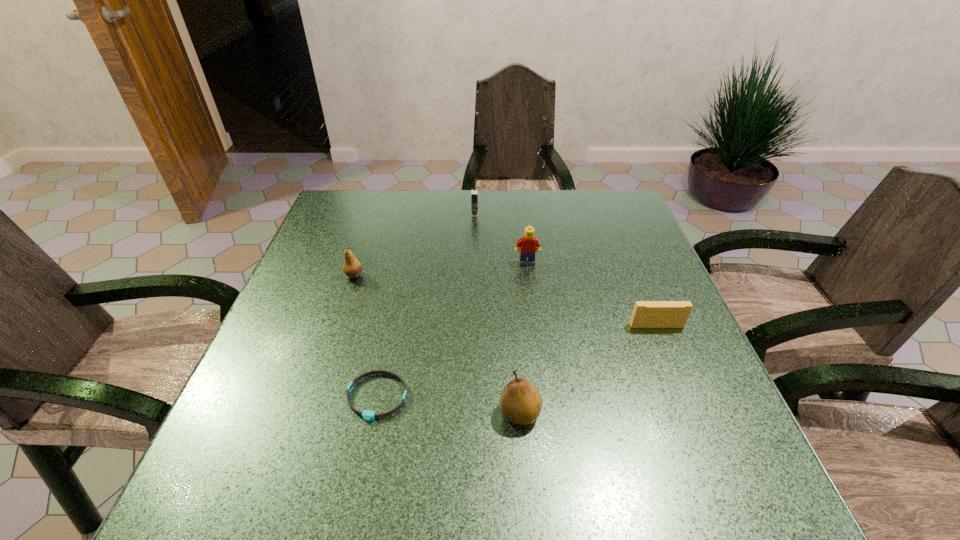
Image resolution: width=960 pixels, height=540 pixels. I want to click on vacant area that lies between the wristband and the right pear, so click(x=448, y=405).

You are a GUI agent. You are given a task and a screenshot of the screen. Output one action in this format:
    pyautogui.click(x=<x>, y=<y>)
    Task: Click on the vacant point located between the cellular telephone and the nearer pear
    The image size is (960, 540).
    Given the screenshot: What is the action you would take?
    pyautogui.click(x=497, y=314)

This screenshot has width=960, height=540. What are the coordinates of `free space between the farther pear and the videotape` in the screenshot? It's located at (505, 301).

Locate an element on the screen. The width and height of the screenshot is (960, 540). free space between the videotape and the left pear is located at coordinates (505, 301).

Image resolution: width=960 pixels, height=540 pixels. Find the location of `empty location between the left pear and the nearer pear`. empty location between the left pear and the nearer pear is located at coordinates (437, 345).

Choose which object is the third nearest neighbor to the second farthest object. Please provide its 2D coordinates. Your answer should be formatted as a tuple, i.e. [(x, y)], where the tuple contains the x and y coordinates of a point satisfying the conditions above.

[(352, 268)]

Locate which object is the closest to the shortest object. Please provide its 2D coordinates. Your answer should be formatted as a tuple, i.e. [(x, y)], where the tuple contains the x and y coordinates of a point satisfying the conditions above.

[(520, 402)]

Find the location of a particular element. The height and width of the screenshot is (540, 960). free space that satisfies the following two spatial constraints: 1. on the buckle of the right pear; 2. on the left side of the wristband is located at coordinates (373, 413).

Where is `free location that satisfies the following two spatial constraints: 1. on the front-facing side of the farthest object; 2. on the right side of the nearer pear`? The height and width of the screenshot is (540, 960). free location that satisfies the following two spatial constraints: 1. on the front-facing side of the farthest object; 2. on the right side of the nearer pear is located at coordinates (471, 413).

This screenshot has height=540, width=960. What are the coordinates of `free space that satisfies the following two spatial constraints: 1. on the front-facing side of the cellular telephone; 2. on the left side of the nearer pear` in the screenshot? It's located at (471, 413).